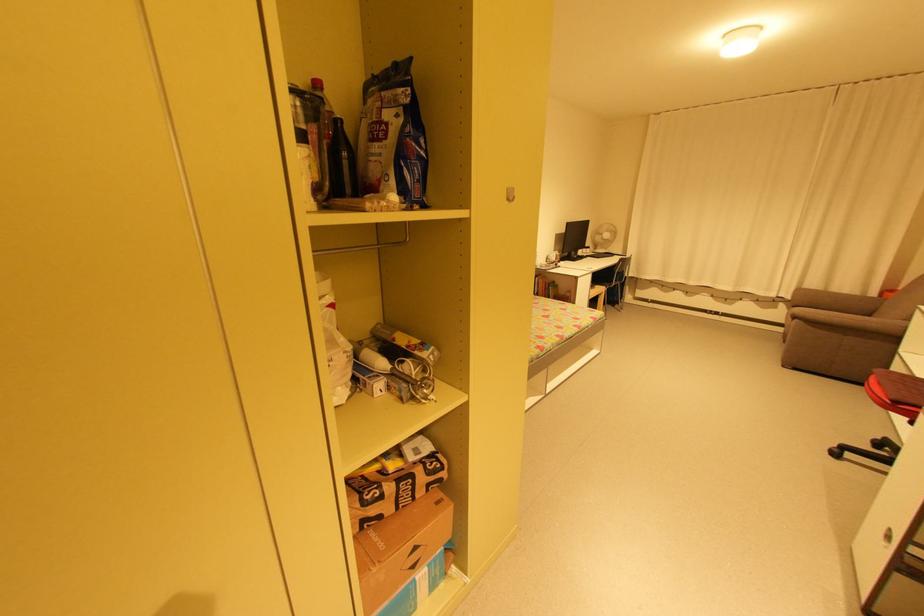
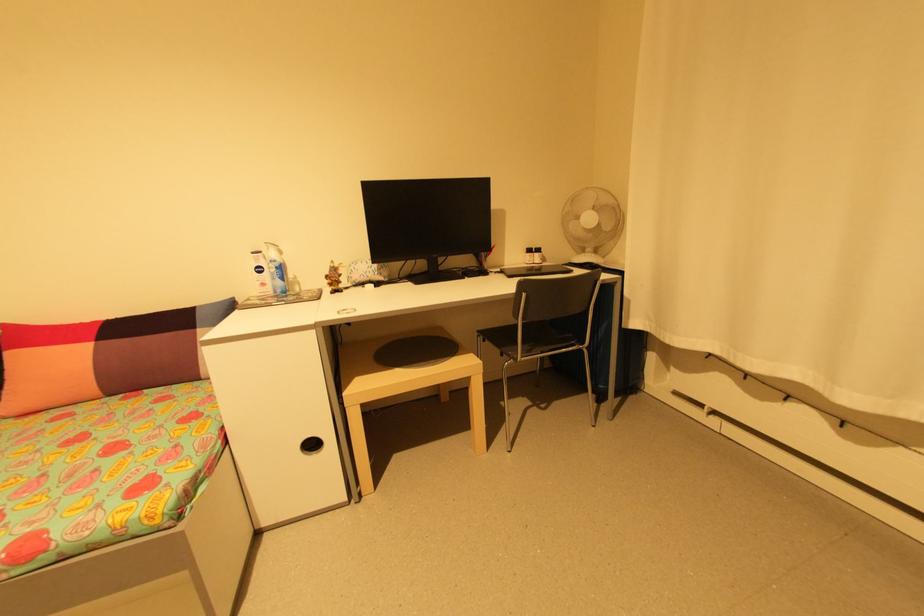
The point at (592, 249) is marked in the first image. Where is the corresponding point in the second image?

(541, 254)